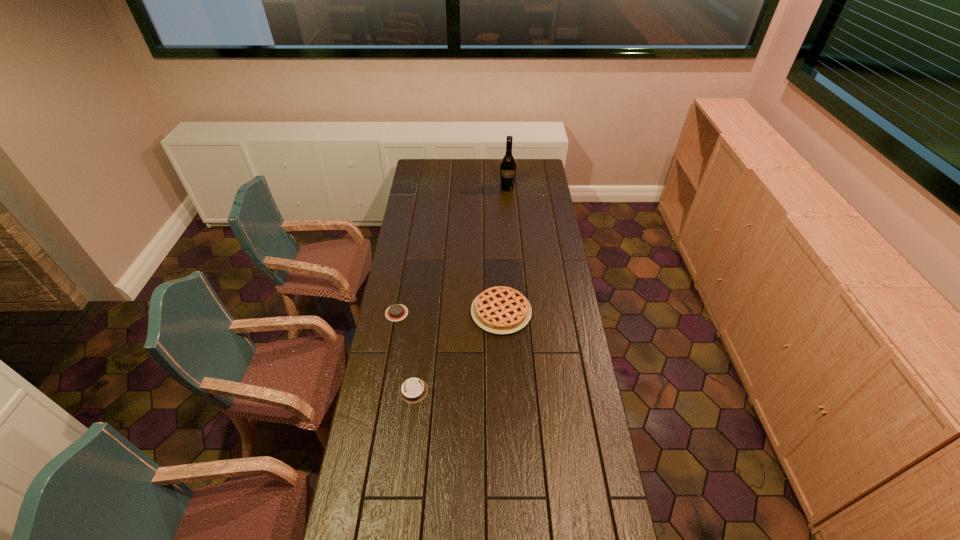
Where is `free space that is in between the second object from left to right and the farther chocolate cake`? The image size is (960, 540). free space that is in between the second object from left to right and the farther chocolate cake is located at coordinates (405, 352).

At what (x,y) coordinates should I click in order to perform the action: click on empty space that is in between the wine bottle and the right chocolate cake. Please return your answer as a coordinate pair (x, y). Looking at the image, I should click on (461, 289).

Identify the location of vacant region between the farther chocolate cake and the pie. The image size is (960, 540). [x=449, y=313].

Find the location of `empty space between the tallest object and the pie`. empty space between the tallest object and the pie is located at coordinates (504, 250).

Select which object is the second closest to the nearest object. Please provide its 2D coordinates. Your answer should be formatted as a tuple, i.e. [(x, y)], where the tuple contains the x and y coordinates of a point satisfying the conditions above.

[(397, 312)]

Locate an element on the screen. The width and height of the screenshot is (960, 540). object that is the second closest to the farthest object is located at coordinates (397, 312).

The image size is (960, 540). Identify the location of free location that satisfies the following two spatial constraints: 1. on the front side of the leftmost object; 2. on the left side of the second object from left to right. (383, 390).

At what (x,y) coordinates should I click in order to perform the action: click on vacant space that satisfies the following two spatial constraints: 1. on the back side of the second object from left to right; 2. on the right side of the pie. Please return your answer as a coordinate pair (x, y). Image resolution: width=960 pixels, height=540 pixels. Looking at the image, I should click on (423, 312).